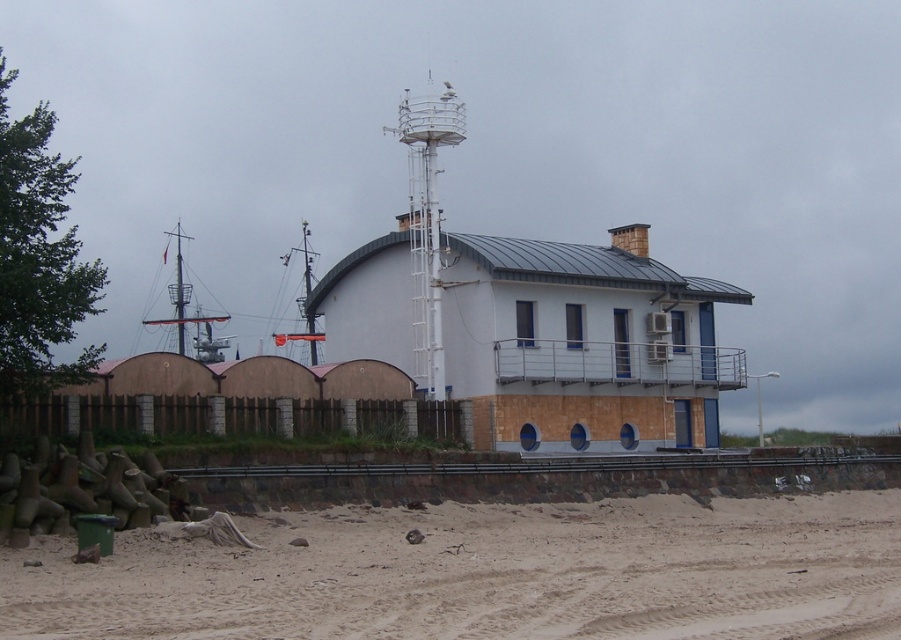
Question: Is white painted wood hut at center to the left of white metallic mast at upper center from the viewer's perspective?

Choices:
 (A) yes
 (B) no

Answer: (B)

Question: Which object is closer to the camera taking this photo?

Choices:
 (A) white painted wood hut at center
 (B) white metallic mast at upper center
 (C) brown sandy dirt at lower center
 (D) polished wood ship at left

Answer: (C)

Question: Does brown sandy dirt at lower center appear over polished wood ship at left?

Choices:
 (A) no
 (B) yes

Answer: (A)

Question: Does brown sandy dirt at lower center have a larger size compared to white metallic mast at upper center?

Choices:
 (A) no
 (B) yes

Answer: (A)

Question: Which is farther from the polished wood ship at left?

Choices:
 (A) white painted wood hut at center
 (B) white metallic mast at upper center
 (C) brown sandy dirt at lower center

Answer: (C)

Question: Which point appears farthest from the camera in this image?

Choices:
 (A) (793, 609)
 (B) (175, 320)
 (C) (415, 371)
 (D) (480, 246)

Answer: (B)